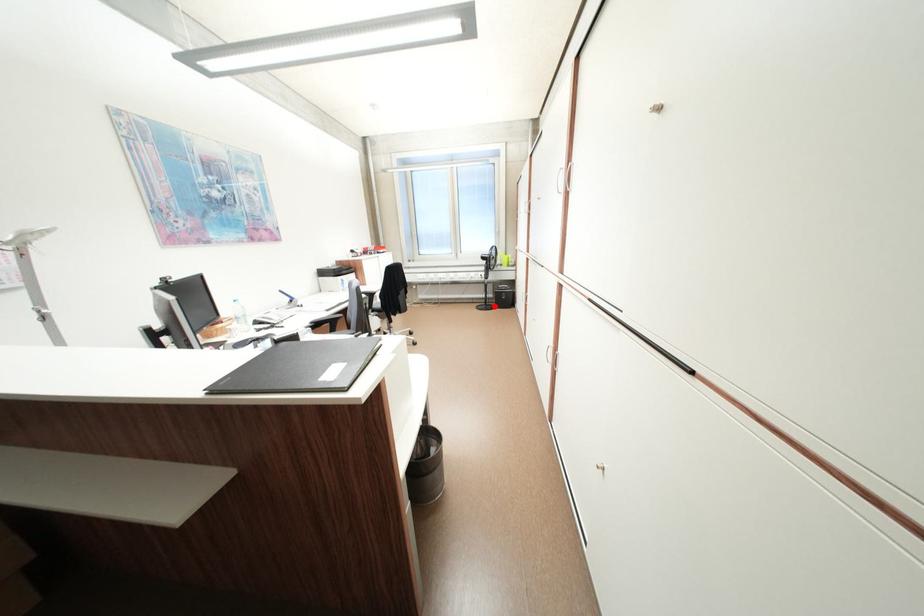
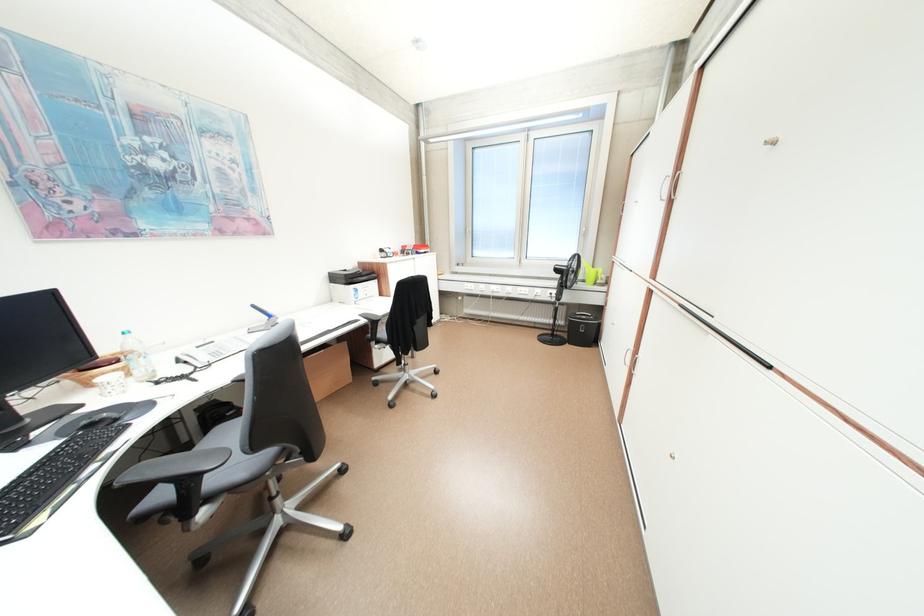
Question: I am providing you with two images of the same scene from different viewpoints. Given a red point in image1, look at the same physical point in image2. Is it:

Choices:
 (A) Closer to the viewpoint
 (B) Farther from the viewpoint

Answer: (A)